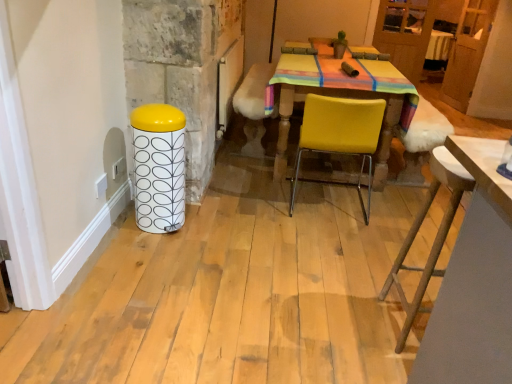
Where is `blank space to the left of yellow matte chair at center`? This screenshot has height=384, width=512. blank space to the left of yellow matte chair at center is located at coordinates (259, 201).